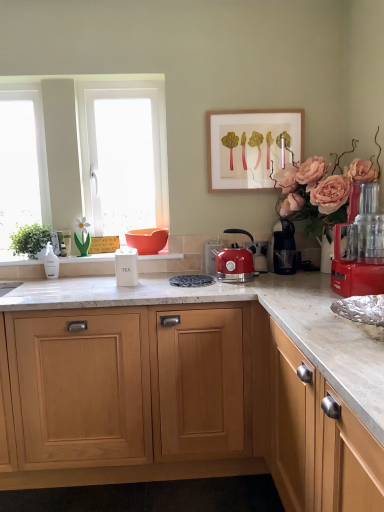
The image size is (384, 512). I want to click on vacant area situated to the left side of white glossy bottle at left, positioned as the first kitchen appliance in back-to-front order, so click(23, 281).